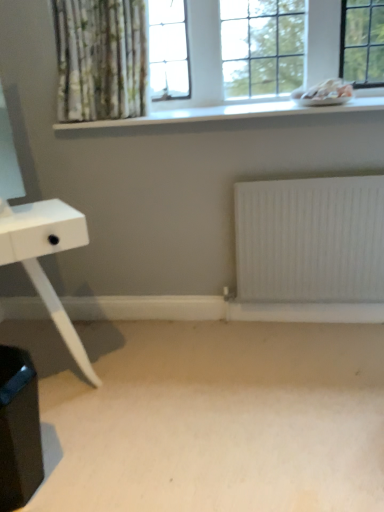
Question: Based on their sizes in the image, would you say beige carpet at lower center is bigger or smaller than white smooth window sill at upper center?

Choices:
 (A) big
 (B) small

Answer: (A)

Question: Is beige carpet at lower center taller or shorter than white smooth window sill at upper center?

Choices:
 (A) tall
 (B) short

Answer: (B)

Question: Which object is positioned farthest from the white matte radiator at lower center?

Choices:
 (A) white glass window at upper center
 (B) beige carpet at lower center
 (C) white matte table at left
 (D) white smooth window sill at upper center

Answer: (C)

Question: Which object is positioned closest to the white matte table at left?

Choices:
 (A) white glass window at upper center
 (B) beige carpet at lower center
 (C) white smooth window sill at upper center
 (D) white matte radiator at lower center

Answer: (B)